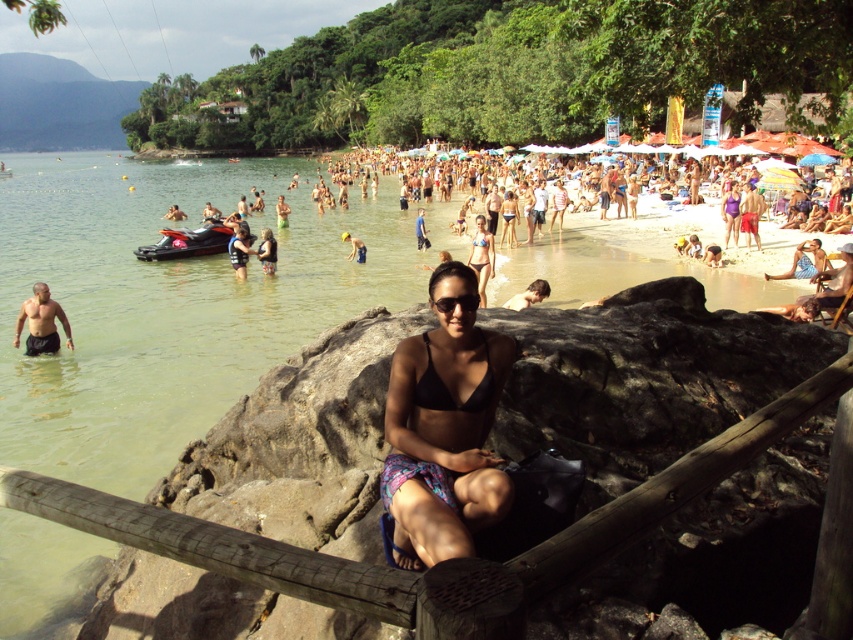
Where is the black bikini at center located in the image?

The black bikini at center is located at point coordinates of 0.669 in the x axis and 0.522 in the y axis.

You are a photographer at the beach and want to capture both the black bikini at center and the blue bikini at center in a single shot. Which bikini should you focus on first to ensure both are in frame?

The black bikini at center has a greater height compared to blue bikini at center, so focusing on the black bikini at center first will help ensure both are in frame.